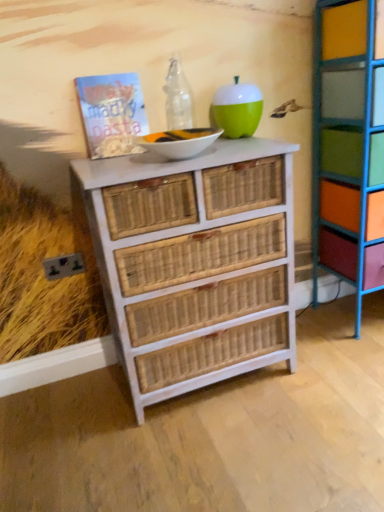
Where is `vacant space underneath multicolored painted wood shelf at right (from a real-world perspective)`? This screenshot has width=384, height=512. vacant space underneath multicolored painted wood shelf at right (from a real-world perspective) is located at coordinates (354, 316).